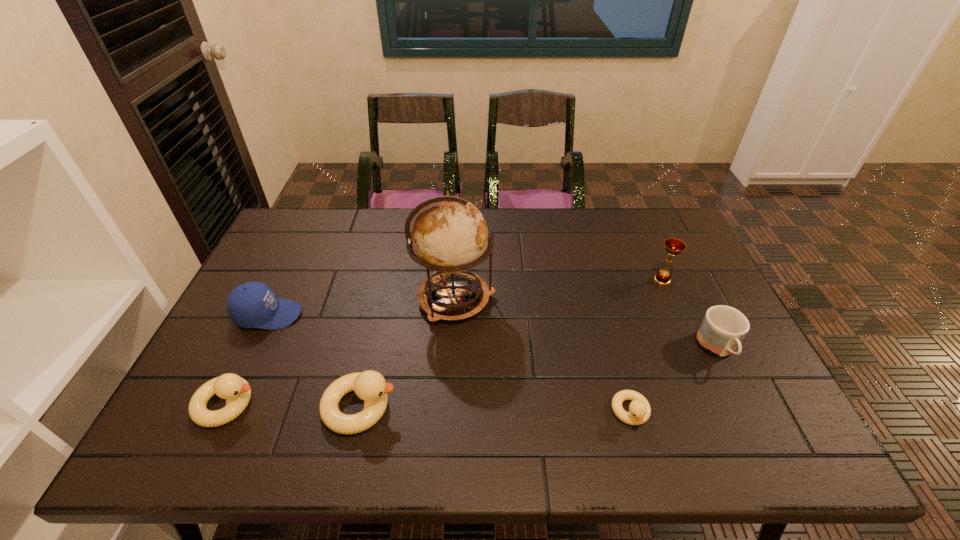
Identify the location of free space at the near edge of the desktop. (477, 413).

Where is `vacant area at the left edge of the desktop`? Image resolution: width=960 pixels, height=540 pixels. vacant area at the left edge of the desktop is located at coordinates (252, 361).

At what (x,y) coordinates should I click in order to perform the action: click on vacant area at the right edge of the desktop. Please return your answer as a coordinate pair (x, y). This screenshot has height=540, width=960. Looking at the image, I should click on [x=700, y=275].

Where is `free region at the far left corner of the desktop`? This screenshot has width=960, height=540. free region at the far left corner of the desktop is located at coordinates (x=270, y=244).

Identify the location of vacant space at the near right corner of the desktop. The height and width of the screenshot is (540, 960). (750, 387).

Image resolution: width=960 pixels, height=540 pixels. In order to click on vacant point located between the chalice and the second duckling from right to left in this screenshot , I will do `click(512, 343)`.

Where is `free space that is in between the chalice and the second duckling from left to right`? This screenshot has width=960, height=540. free space that is in between the chalice and the second duckling from left to right is located at coordinates (512, 343).

The image size is (960, 540). I want to click on vacant space in between the globe and the chalice, so click(559, 289).

This screenshot has height=540, width=960. In order to click on vacant area that lies between the leftmost duckling and the second duckling from right to left in this screenshot , I will do `click(294, 406)`.

Locate an element on the screen. This screenshot has width=960, height=540. free space between the cap and the leftmost duckling is located at coordinates (248, 360).